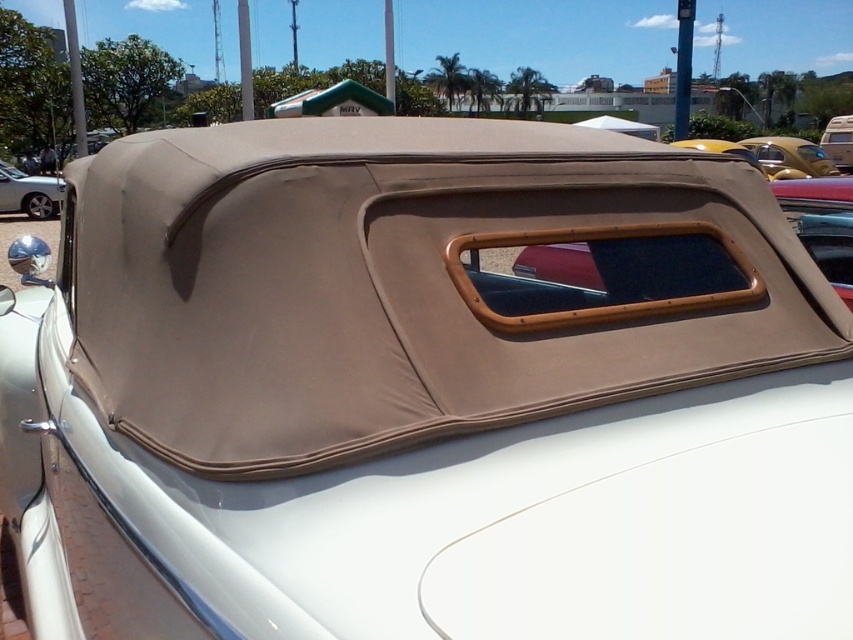
Question: Which object is closer to the camera taking this photo?

Choices:
 (A) matte black car at left
 (B) beige fabric car at center

Answer: (A)

Question: Which point is closer to the camera?

Choices:
 (A) (x=850, y=168)
 (B) (x=13, y=193)

Answer: (B)

Question: From the image, what is the correct spatial relationship of beige fabric convertible top at center in relation to matte black car at left?

Choices:
 (A) above
 (B) below

Answer: (A)

Question: Which of the following is the closest to the observer?

Choices:
 (A) beige fabric car at center
 (B) beige fabric convertible top at center

Answer: (B)

Question: Observing the image, what is the correct spatial positioning of beige fabric convertible top at center in reference to matte black car at left?

Choices:
 (A) below
 (B) above

Answer: (B)

Question: In this image, where is beige fabric convertible top at center located relative to beige fabric car at center?

Choices:
 (A) above
 (B) below

Answer: (B)